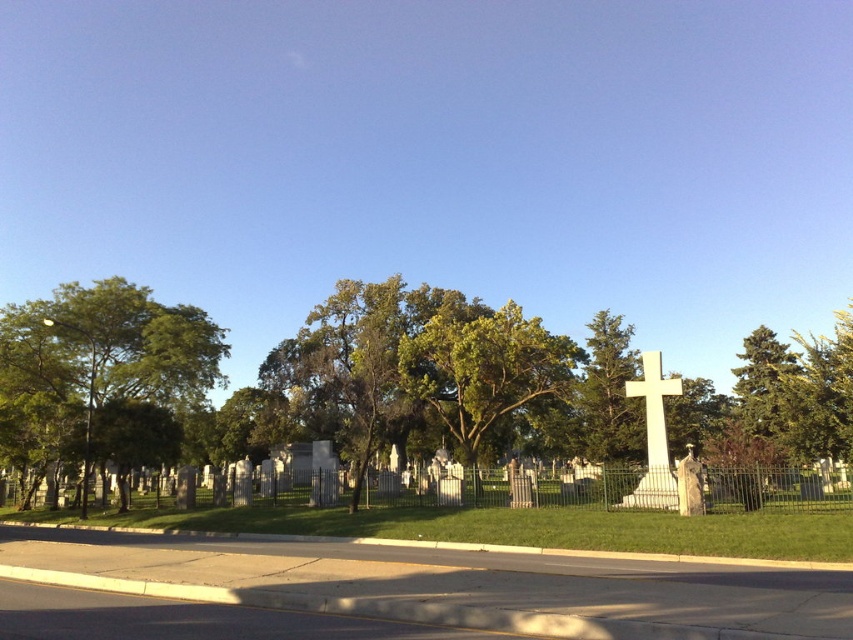
You are a gardener who needs to water both the green leafy tree at left and the white marble cross at right. If your watering can holds enough water for 20 meters of travel, can you water both without refilling?

The distance between the green leafy tree at left and the white marble cross at right is 22.02 meters. Since your watering can only allows for 20 meters of travel, you cannot water both without refilling.

You are standing at the entrance of the cemetery and see two points marked on the ground. The first point is at coordinate point (x=200, y=344) and the second is at coordinate point (x=454, y=406). Which point is closer to you?

Point (x=200, y=344) is closer to the viewer than point (x=454, y=406).

You are standing at the entrance of the cemetery and see the green leafy tree at left and the green leafy tree at center. Which tree is closer to you?

The green leafy tree at left is closer to you because it is in front of the green leafy tree at center.